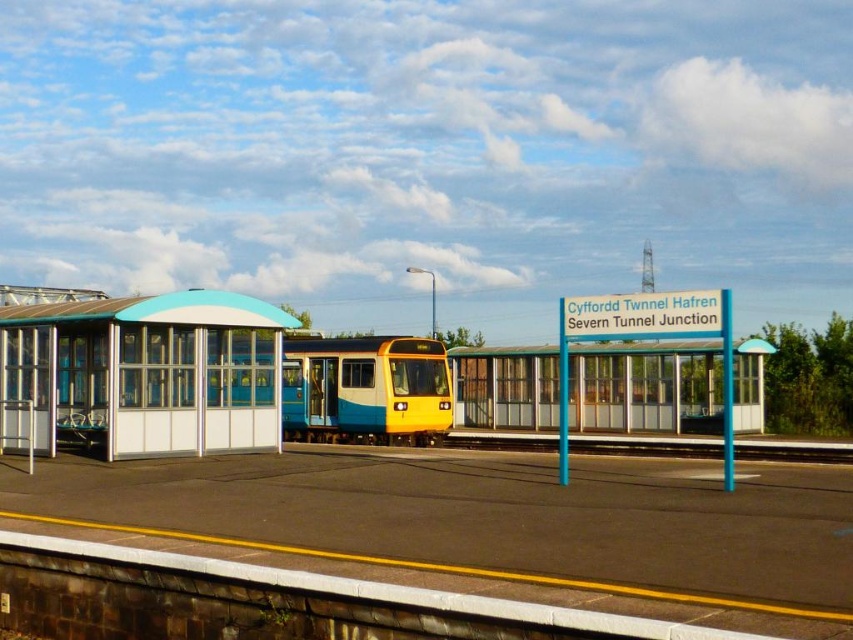
Question: Which object is farther from the camera taking this photo?

Choices:
 (A) white glass bus station at left
 (B) metal train track at center
 (C) blue glass bus stop at center
 (D) yellow matte passenger train at center

Answer: (B)

Question: Which point appears closest to the camera in this image?

Choices:
 (A) (560, 390)
 (B) (448, 390)
 (C) (105, 332)

Answer: (C)

Question: Is blue glass bus stop at center below metal train track at center?

Choices:
 (A) yes
 (B) no

Answer: (B)

Question: Which object is closer to the camera taking this photo?

Choices:
 (A) white glass bus station at left
 (B) blue glass bus stop at center

Answer: (B)

Question: From the image, what is the correct spatial relationship of white glass bus station at left in relation to blue glass bus stop at center?

Choices:
 (A) above
 (B) below

Answer: (B)

Question: Does white glass bus station at left appear over yellow matte passenger train at center?

Choices:
 (A) yes
 (B) no

Answer: (A)